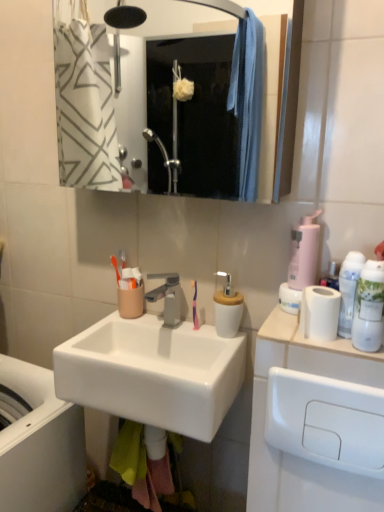
Question: Is white glossy mouthwash at right, which is the second mouthwash in back-to-front order, wider or thinner than white glossy sink at lower left?

Choices:
 (A) thin
 (B) wide

Answer: (A)

Question: From a real-world perspective, is white glossy mouthwash at right, which is the second mouthwash in back-to-front order, positioned above or below white glossy sink at lower left?

Choices:
 (A) below
 (B) above

Answer: (B)

Question: Which object is positioned farthest from the purple plastic toothbrush at center?

Choices:
 (A) white matte toilet paper at right
 (B) metallic silver mirror at upper center
 (C) pink matte soap dispenser at right
 (D) white glossy mouthwash at right, which is the second mouthwash in back-to-front order
 (E) white glossy sink at center

Answer: (B)

Question: Which is farther from the white plastic mouthwash at right, the second mouthwash when ordered from front to back?

Choices:
 (A) purple plastic toothbrush at center
 (B) white plastic drawer at lower right
 (C) pink matte soap dispenser at right
 (D) white glossy mouthwash at right, marked as the 1th mouthwash in a front-to-back arrangement
 (E) satin nickel faucet at center

Answer: (E)